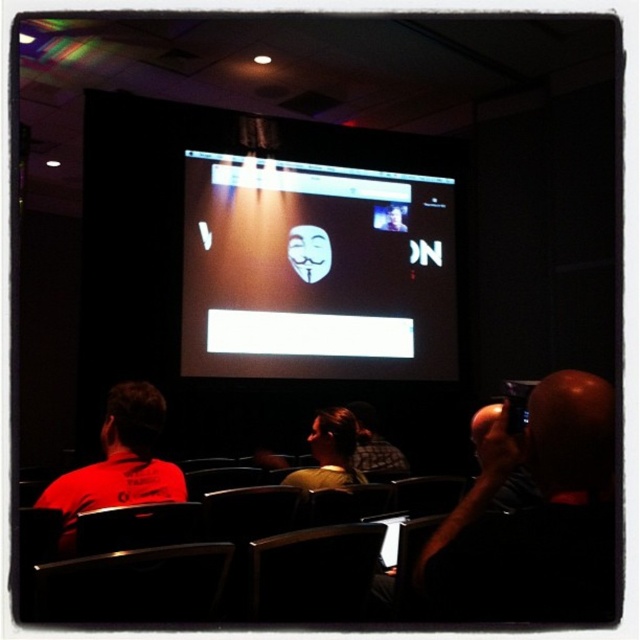
Question: Does matte black mask at center have a greater width compared to red matte shirt at left?

Choices:
 (A) no
 (B) yes

Answer: (B)

Question: Which point is closer to the camera?

Choices:
 (A) red matte shirt at left
 (B) matte yellow shirt at center
 (C) matte black mask at center
 (D) white matte mask at center

Answer: (A)

Question: Among these objects, which one is farthest from the camera?

Choices:
 (A) bald head camera at right
 (B) matte yellow shirt at center
 (C) red matte shirt at left

Answer: (B)

Question: Can you confirm if matte black mask at center is thinner than white matte mask at center?

Choices:
 (A) yes
 (B) no

Answer: (B)

Question: Is matte black mask at center to the right of bald head camera at right from the viewer's perspective?

Choices:
 (A) yes
 (B) no

Answer: (B)

Question: Which object is the closest to the matte black mask at center?

Choices:
 (A) bald head camera at right
 (B) red matte shirt at left
 (C) white matte mask at center

Answer: (C)